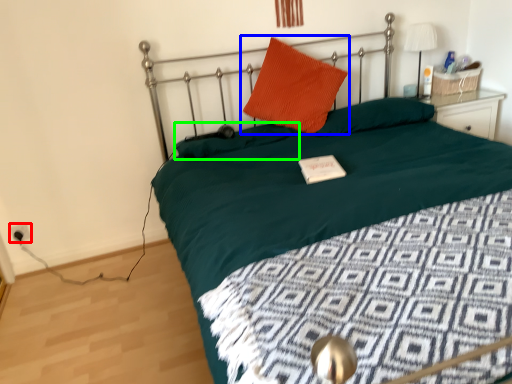
Question: Which object is the farthest from electric outlet (highlighted by a red box)? Choose among these: pillow (highlighted by a blue box) or pillow (highlighted by a green box).

Choices:
 (A) pillow
 (B) pillow

Answer: (A)